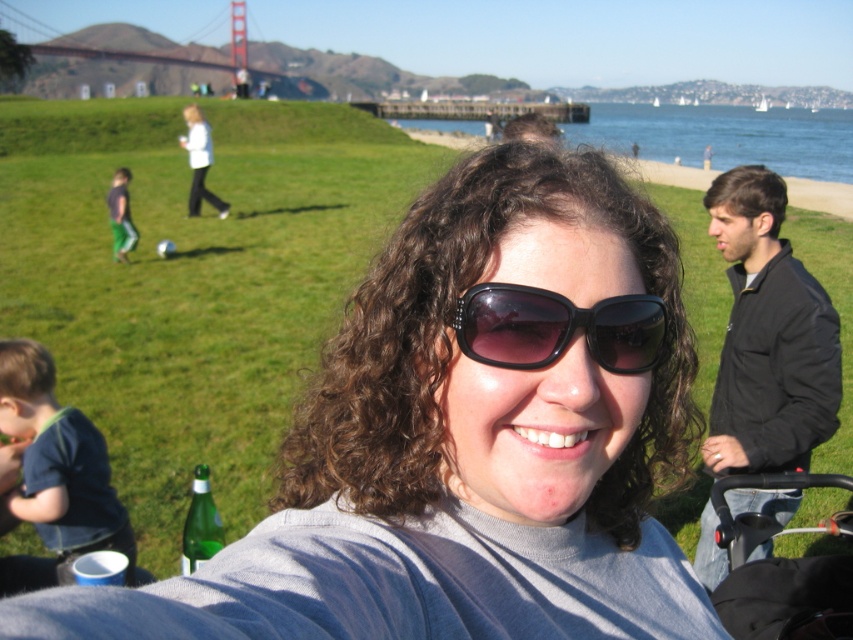
You are standing at the park and want to take a photo of the blue water at upper right and the dark gray pants at left. Which object should you zoom in on to capture both in the frame without moving your camera?

You should zoom in on the dark gray pants at left because the blue water at upper right is wider than the dark gray pants at left, so zooming in on the wider object would allow both to fit in the frame.

You are standing at the point marked by the coordinates point (x=724, y=136) in the park scene. Looking around, you see the blue water at upper right. Which direction should you face to see the blue water at upper right?

You should face the upper right direction to see the blue water at upper right, as it is located at the upper right of the scene.

You are a photographer trying to capture a photo of the soccer ball in the park scene. You notice the black plastic baby carriage at lower right and the dark gray pants at left might block your view. Which object is taller, making it more likely to obstruct your shot?

The dark gray pants at left are taller than the black plastic baby carriage at lower right, so they are more likely to obstruct your shot.